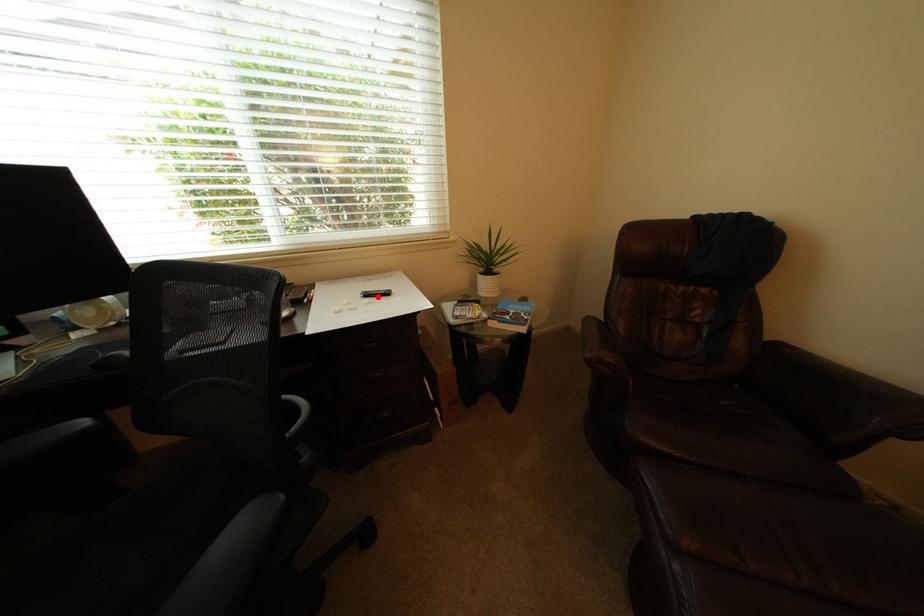
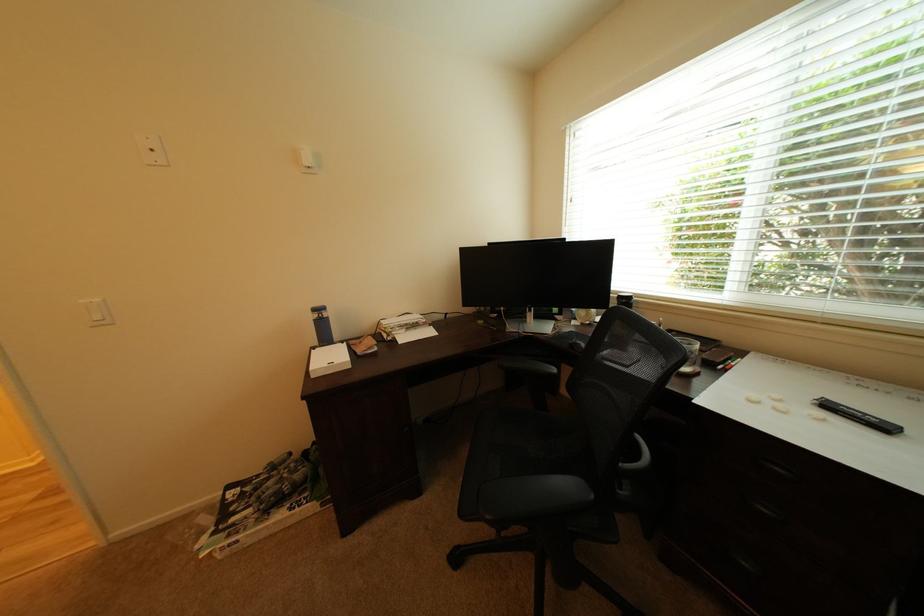
Find the pixel in the second image that matches the highlighted location in the first image.

(840, 408)